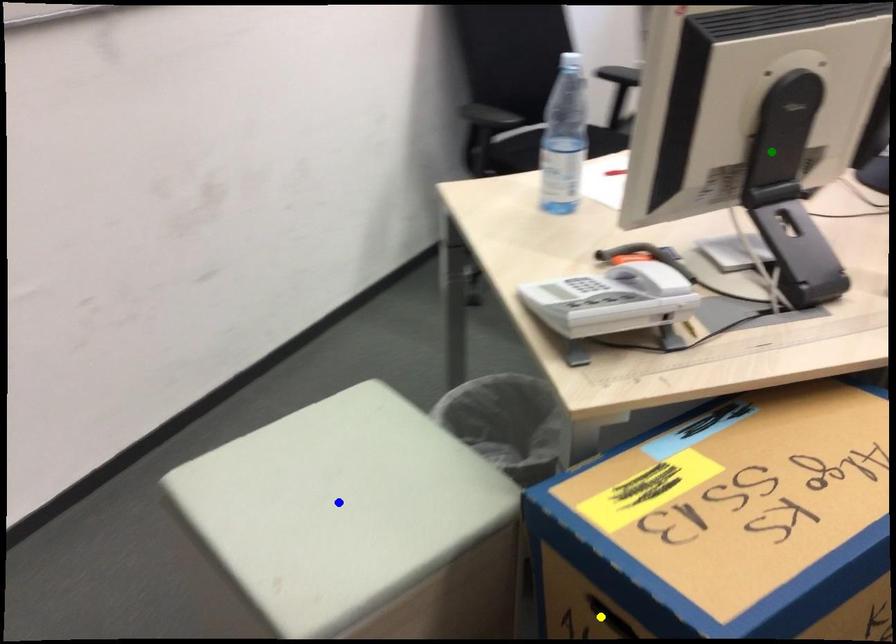
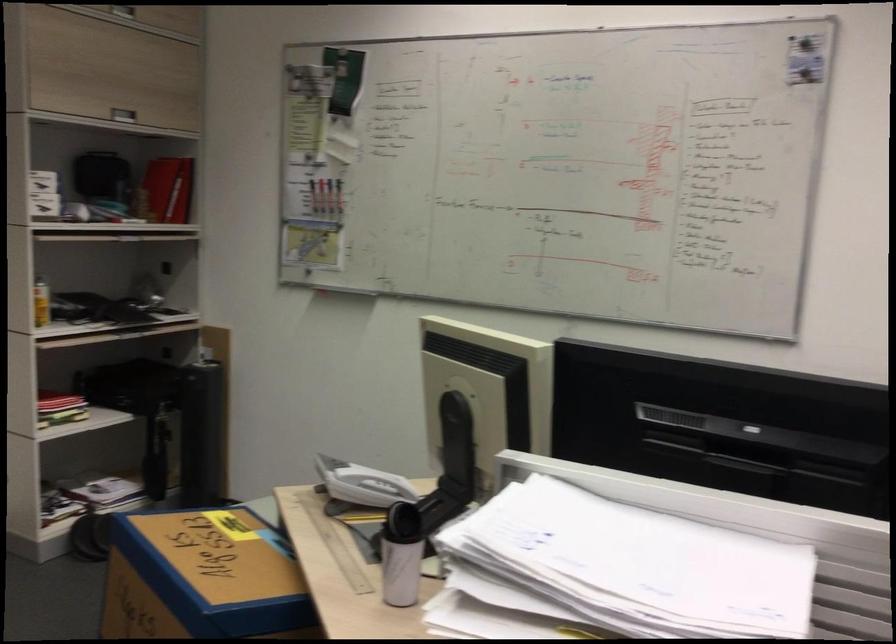
I am providing you with two images of the same scene from different viewpoints. Three points are marked in image1. Which point corresponds to a part or object that is occluded in image2?In image1, three points are marked. Which of them correspond to a part or object that is occluded in image2?Among the three points shown in image1, which one corresponds to a part or object that is no longer visible due to occlusion in image2?

Invisible in image2: blue point, yellow point.